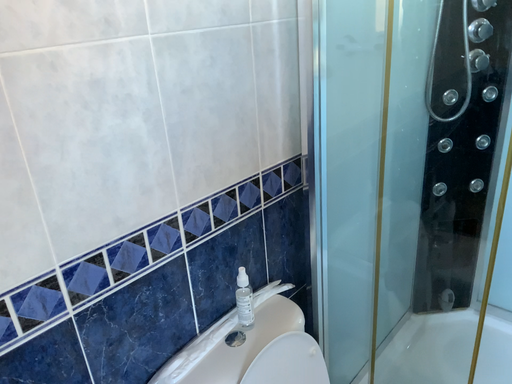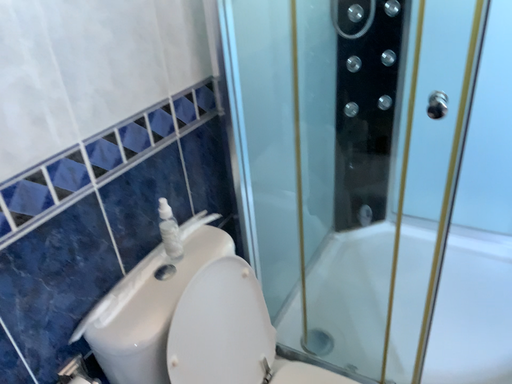
Question: Which way did the camera rotate in the video?

Choices:
 (A) rotated right
 (B) rotated left

Answer: (A)